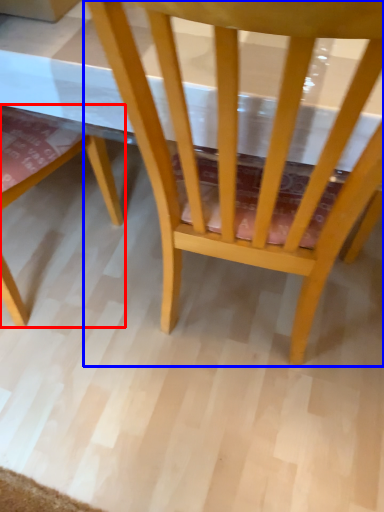
Question: Which point is closer to the camera, chair (highlighted by a red box) or chair (highlighted by a blue box)?

Choices:
 (A) chair
 (B) chair

Answer: (B)